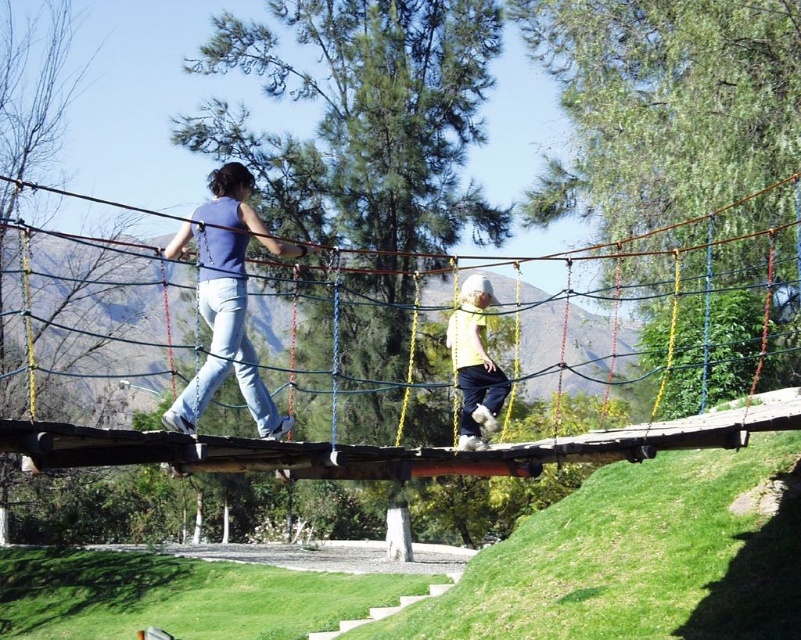
Is wooden suspension bridge at center positioned behind light yellow fabric at center?

No.

Which of these two, wooden suspension bridge at center or light yellow fabric at center, stands shorter?

With less height is light yellow fabric at center.

Is point (57, 440) closer to camera compared to point (477, 289)?

Yes, it is.

The height and width of the screenshot is (640, 801). What are the coordinates of `wooden suspension bridge at center` in the screenshot? It's located at (379, 448).

Who is more distant from viewer, (218, 269) or (492, 429)?

The point (492, 429) is more distant.

Between matte blue tank top at center and light yellow fabric at center, which one is positioned lower?

light yellow fabric at center is below.

In order to click on matte blue tank top at center in this screenshot , I will do `click(226, 300)`.

Does wooden suspension bridge at center have a lesser height compared to matte blue tank top at center?

Indeed, wooden suspension bridge at center has a lesser height compared to matte blue tank top at center.

Does wooden suspension bridge at center have a greater width compared to matte blue tank top at center?

Indeed, wooden suspension bridge at center has a greater width compared to matte blue tank top at center.

Between point (643, 436) and point (230, 291), which one is positioned in front?

Point (230, 291) is more forward.

Identify the location of wooden suspension bridge at center. Image resolution: width=801 pixels, height=640 pixels. (379, 448).